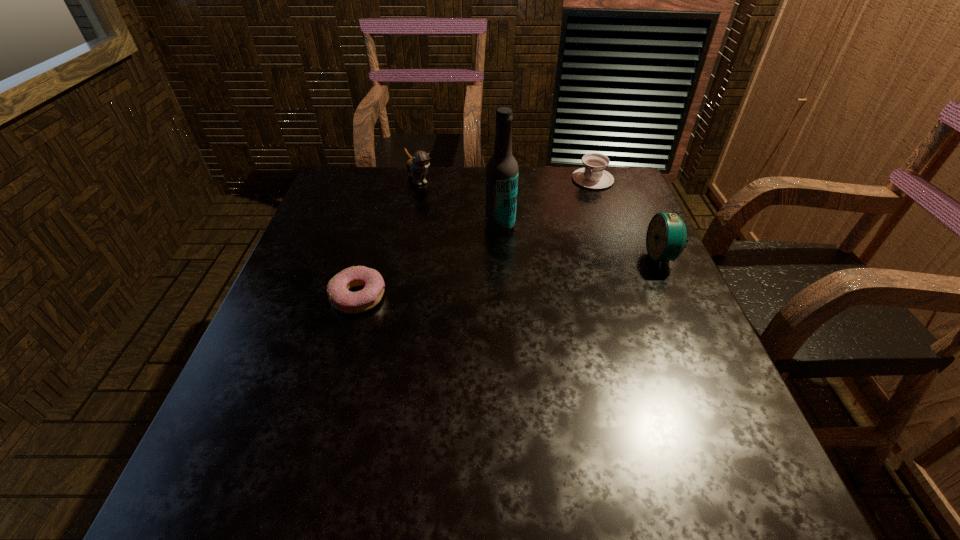
In order to click on free space at the left edge in this screenshot , I will do `click(326, 377)`.

This screenshot has width=960, height=540. Find the location of `free spot at the right edge of the desktop`. free spot at the right edge of the desktop is located at coordinates (656, 275).

In the image, there is a desktop. Where is `vacant space at the far left corner`? The width and height of the screenshot is (960, 540). vacant space at the far left corner is located at coordinates (357, 191).

This screenshot has width=960, height=540. In the image, there is a desktop. Identify the location of vacant space at the far right corner. (601, 195).

Image resolution: width=960 pixels, height=540 pixels. I want to click on free space at the near right corner of the desktop, so click(716, 401).

The height and width of the screenshot is (540, 960). Identify the location of free area in between the alarm clock and the teacup. (627, 218).

Image resolution: width=960 pixels, height=540 pixels. I want to click on free space between the tallest object and the shortest object, so click(429, 261).

The image size is (960, 540). I want to click on vacant point located between the beer bottle and the kitten, so click(x=460, y=202).

I want to click on unoccupied position between the alarm clock and the shortest object, so click(510, 277).

Find the location of a particular element. free space between the alarm clock and the kitten is located at coordinates (540, 218).